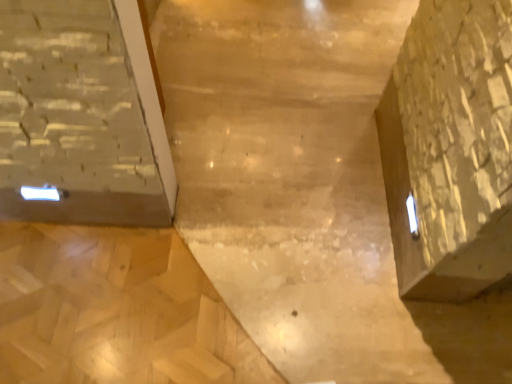
Image resolution: width=512 pixels, height=384 pixels. What do you see at coordinates (412, 216) in the screenshot? I see `clear glass window at upper right` at bounding box center [412, 216].

What is the approximate width of clear glass window at upper right?

clear glass window at upper right is 2.23 centimeters in width.

Locate an element on the screen. This screenshot has height=384, width=512. clear glass window at upper right is located at coordinates (412, 216).

The height and width of the screenshot is (384, 512). I want to click on clear glass window at upper right, so click(412, 216).